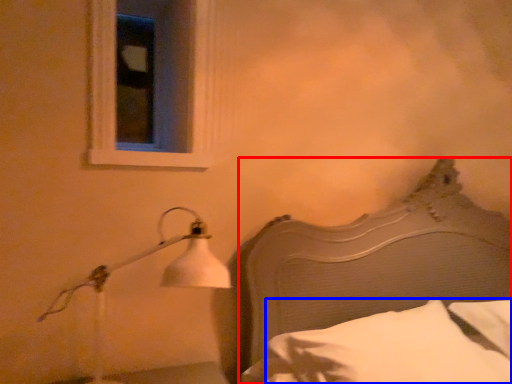
Question: Which object appears farthest to the camera in this image, bed (highlighted by a red box) or pillow (highlighted by a blue box)?

Choices:
 (A) bed
 (B) pillow

Answer: (B)